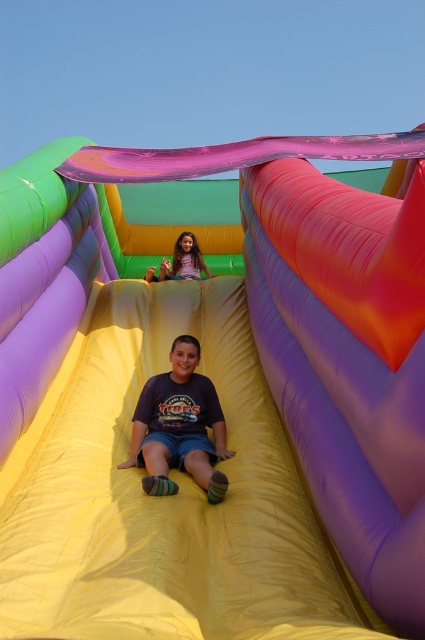
Question: Can you confirm if dark blue t-shirt at center is positioned above matte purple shirt at upper center?

Choices:
 (A) yes
 (B) no

Answer: (B)

Question: Which point is farther to the camera?

Choices:
 (A) matte purple shirt at upper center
 (B) dark blue t-shirt at center

Answer: (A)

Question: Does dark blue t-shirt at center appear under matte purple shirt at upper center?

Choices:
 (A) no
 (B) yes

Answer: (B)

Question: Can you confirm if dark blue t-shirt at center is positioned to the right of matte purple shirt at upper center?

Choices:
 (A) yes
 (B) no

Answer: (A)